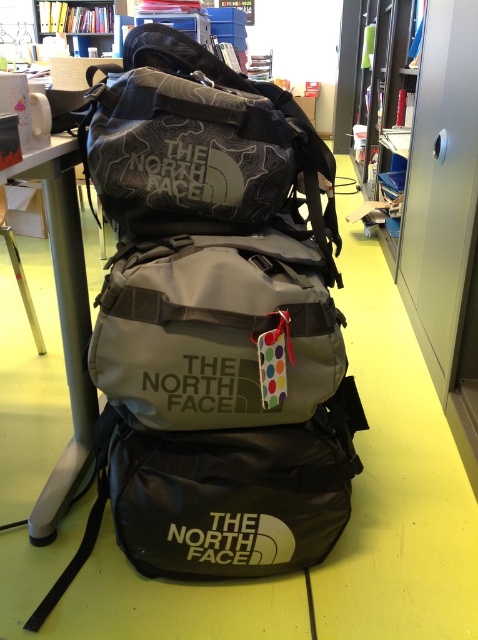
You are an office worker who needs to place a 1.2m tall potted plant on either the metallic silver table at left or the wooden bookshelf at upper left. Based on their heights, which surface can safely support the plant without it toppling over?

The metallic silver table at left is taller than the wooden bookshelf at upper left. Since the plant is 1.2m tall, placing it on the taller metallic silver table at left would provide a more stable base, reducing the risk of toppling.

You are standing at the origin point in the image. Which object is located at coordinates point (x=65, y=324)?

The metallic silver table at left is located at coordinates point (x=65, y=324).